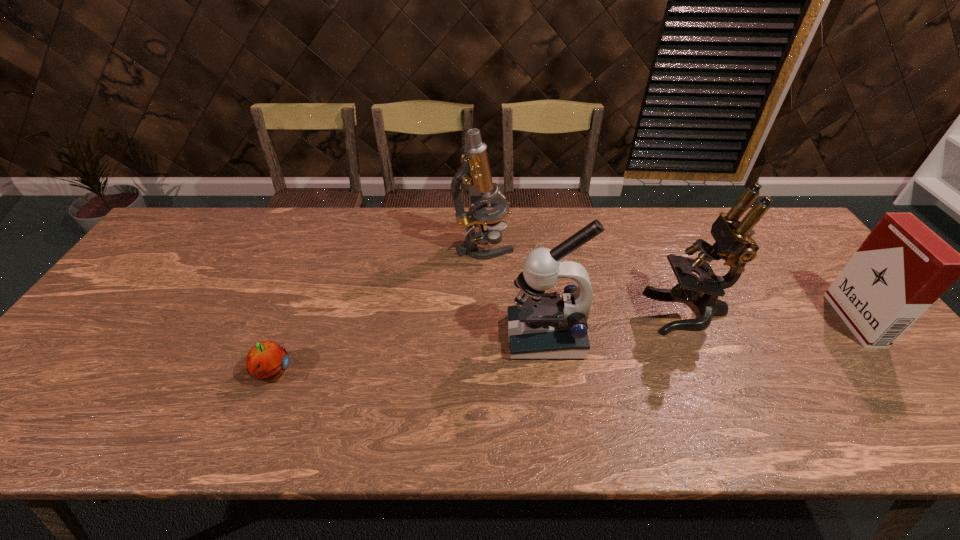
I want to click on the farthest object, so click(x=475, y=170).

In order to click on the fourth object from left to right in this screenshot , I will do `click(733, 244)`.

The width and height of the screenshot is (960, 540). In order to click on the fourth tallest object in this screenshot , I will do `click(903, 267)`.

In order to click on the rightmost object in this screenshot , I will do click(903, 267).

Where is `the shortest object`? This screenshot has height=540, width=960. the shortest object is located at coordinates (x=267, y=361).

Where is `apple`? This screenshot has height=540, width=960. apple is located at coordinates (267, 361).

This screenshot has height=540, width=960. I want to click on free space located on the front of the farthest object, so click(x=484, y=280).

Locate an element on the screen. The height and width of the screenshot is (540, 960). vacant area situated 0.280m at the eyepieces of the fourth object from left to right is located at coordinates (545, 312).

In order to click on free space located 0.290m at the eyepieces of the fourth object from left to right in this screenshot , I will do `click(542, 312)`.

The image size is (960, 540). Identify the location of vacant space located 0.190m at the eyepieces of the fourth object from left to right. (580, 312).